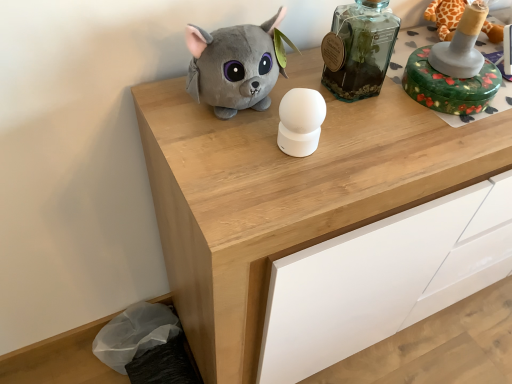
At what (x,y) coordinates should I click in order to perform the action: click on vacant space to the right of transparent glass bottle at upper center. Please return your answer as a coordinate pair (x, y). Looking at the image, I should click on (420, 106).